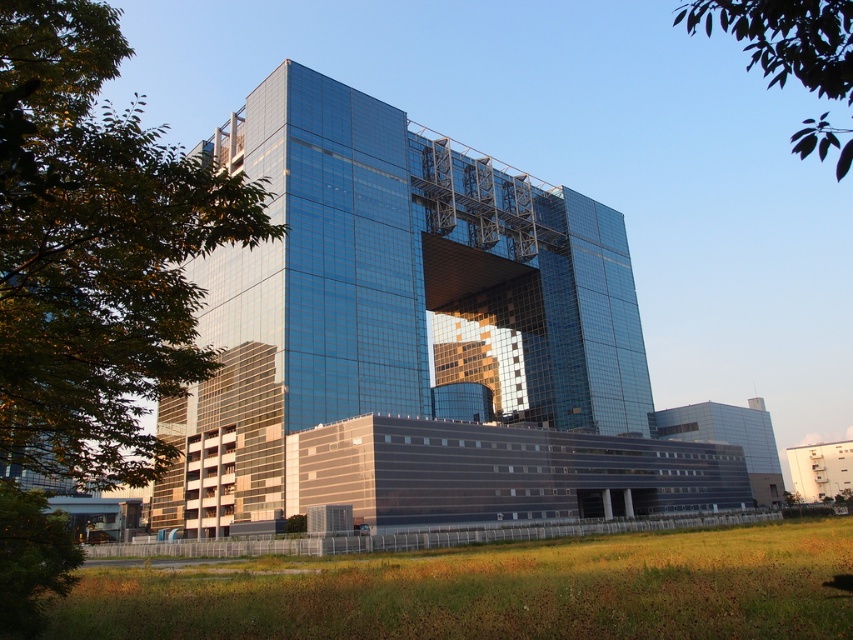
Which of these two, green leafy tree at upper left or green leafy tree at upper right, stands shorter?

With less height is green leafy tree at upper left.

Does green leafy tree at upper left have a lesser height compared to green leafy tree at upper right?

Yes, green leafy tree at upper left is shorter than green leafy tree at upper right.

Find the location of a particular element. This screenshot has height=640, width=853. green leafy tree at upper left is located at coordinates [96, 252].